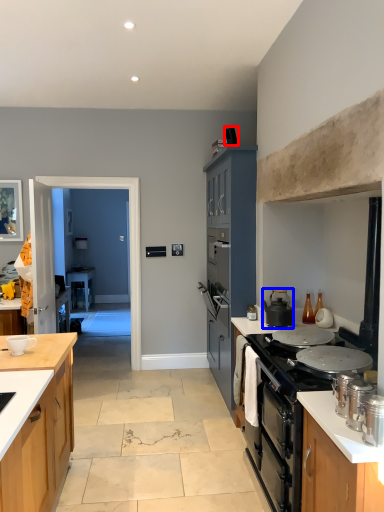
Question: Which of the following is the closest to the observer, corded phone (highlighted by a red box) or kitchen appliance (highlighted by a blue box)?

Choices:
 (A) corded phone
 (B) kitchen appliance

Answer: (B)